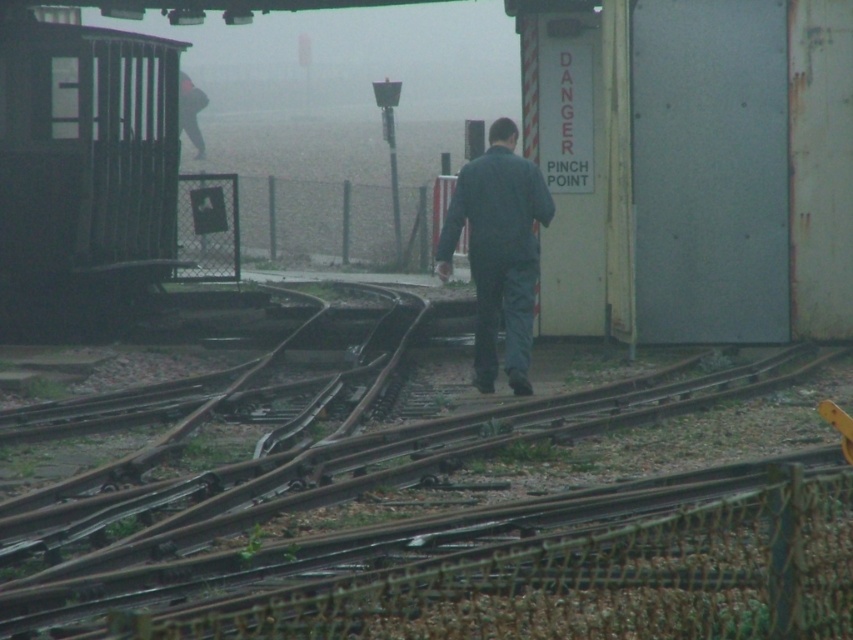
You are a railway worker who needs to cross the tracks safely. You see the dark gray metal train at left and the dark blue fabric at center. Which object is closer to you?

The dark gray metal train at left is closer to you because the dark blue fabric at center is behind it.

You are a railway worker needing to cross the rusty metal tracks at center and the dark gray metal train at left. Which object should you avoid stepping on to stay safe?

You should avoid stepping on the dark gray metal train at left because the rusty metal tracks at center are in front of it, meaning the train is behind the tracks and moving towards you.